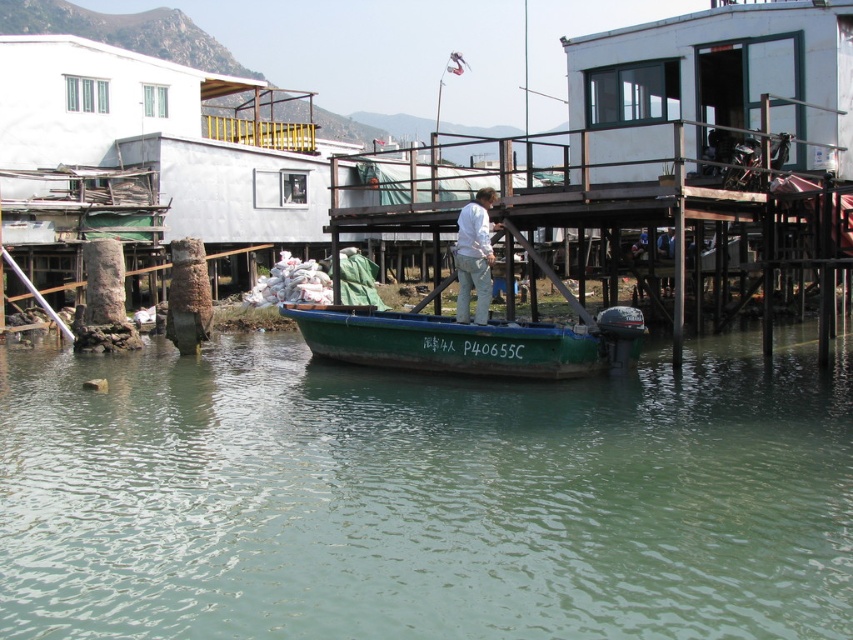
You are a photographer planning to capture the waterfront scene. You want to ensure that both the green matte water at center and the green matte boat at center are clearly visible in your shot. Based on their sizes in the image, which object should you prioritize positioning closer to the camera to maintain detail?

The green matte water at center occupies less space than the green matte boat at center. To ensure both are clearly visible, prioritize positioning the green matte water at center closer to the camera since it is smaller and requires more focus to capture details.

You are a drone operator tasked with capturing aerial footage of the waterfront scene. You need to ensure that your drone avoids the green matte water at center. Given that the point you are targeting is at coordinates point [424,497], will your drone be flying over the green matte water at center?

The point [424,497] is on the green matte water at center, so yes, the drone will be flying over the green matte water at center.

You are a photographer standing on the wooden pier. You want to take a photo of the green matte water at center and the white matte shirt at center. Which object will appear closer to the camera in the photo?

The green matte water at center will appear closer to the camera in the photo because it is in front of the white matte shirt at center.